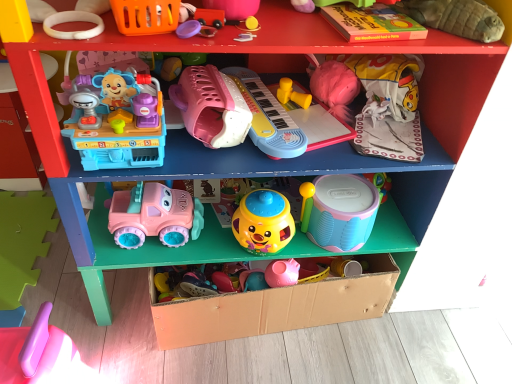
Image resolution: width=512 pixels, height=384 pixels. Find the location of `yellow rubber ball at upper center, which is the 7th toy in right-to-left order`. yellow rubber ball at upper center, which is the 7th toy in right-to-left order is located at coordinates (249, 24).

In order to click on pink plastic keyboard at upper center, which appears as the 3th toy when viewed from the left in this screenshot , I will do `click(211, 107)`.

Measure the distance between pink plastic keyboard at center, which appears as the seventh toy when viewed from the left, and camera.

pink plastic keyboard at center, which appears as the seventh toy when viewed from the left, and camera are 3.53 feet apart.

What is the approximate height of purple plastic lid at upper center, which is the ninth toy in right-to-left order?

It is 0.89 inches.

The height and width of the screenshot is (384, 512). I want to click on yellow plastic toy at upper center, marked as the 4th toy in a right-to-left arrangement, so click(292, 94).

At what (x,y) coordinates should I click in order to perform the action: click on yellow rubber ball at upper center, which is the sixth toy in left-to-right order. Please return your answer as a coordinate pair (x, y). The height and width of the screenshot is (384, 512). Looking at the image, I should click on (249, 24).

Is pink plastic spatula at lower left, marked as the first toy in a left-to-right arrangement, far away from yellow plastic toy at upper center, placed as the ninth toy when sorted from left to right?

That's not correct — pink plastic spatula at lower left, marked as the first toy in a left-to-right arrangement, is a little close to yellow plastic toy at upper center, placed as the ninth toy when sorted from left to right.

There is a pink plastic spatula at lower left, the 12th toy when ordered from right to left. Identify the location of the 5th toy above it (from the image's perspective). The image size is (512, 384). (292, 94).

From the image's perspective, is pink plastic spatula at lower left, marked as the first toy in a left-to-right arrangement, below yellow plastic toy at upper center, placed as the ninth toy when sorted from left to right?

Result: Yes.

Consider the image. From a real-world perspective, does rubber duck at upper center, arranged as the 3th toy when viewed from the right, sit lower than purple plastic lid at upper center, which is the ninth toy in right-to-left order?

Actually, rubber duck at upper center, arranged as the 3th toy when viewed from the right, is physically above purple plastic lid at upper center, which is the ninth toy in right-to-left order, in the real world.

Which is less distant, (383,2) or (183,37)?

Point (383,2) appears to be farther away from the viewer than point (183,37).

Can we say rubber duck at upper center, arranged as the tenth toy when viewed from the left, lies outside purple plastic lid at upper center, which is the fourth toy in left-to-right order?

Yes.

Is rubber duck at upper center, the 8th toy when ordered from right to left, spatially inside yellow matte plastic cup at center, placed as the fifth toy when sorted from right to left, or outside of it?

rubber duck at upper center, the 8th toy when ordered from right to left, is outside yellow matte plastic cup at center, placed as the fifth toy when sorted from right to left.

How many degrees apart are the facing directions of rubber duck at upper center, the 8th toy when ordered from right to left, and yellow matte plastic cup at center, placed as the fifth toy when sorted from right to left?

They differ by 0.00175 degrees in their facing directions.

Is rubber duck at upper center, the 8th toy when ordered from right to left, to the left of yellow matte plastic cup at center, which is the 8th toy in left-to-right order, from the viewer's perspective?

Correct, you'll find rubber duck at upper center, the 8th toy when ordered from right to left, to the left of yellow matte plastic cup at center, which is the 8th toy in left-to-right order.

Is point (254, 6) closer to camera compared to point (250, 214)?

Yes, it is.

Is pastel blue plastic drum at center, the second toy viewed from the right, turned away from pink plastic spatula at lower left, the 12th toy when ordered from right to left?

That's not correct — pastel blue plastic drum at center, the second toy viewed from the right, is not looking away from pink plastic spatula at lower left, the 12th toy when ordered from right to left.

Is pastel blue plastic drum at center, the second toy viewed from the right, surrounding pink plastic spatula at lower left, marked as the first toy in a left-to-right arrangement?

No, pastel blue plastic drum at center, the second toy viewed from the right, does not contain pink plastic spatula at lower left, marked as the first toy in a left-to-right arrangement.

From the image's perspective, which is above, pastel blue plastic drum at center, which is the eleventh toy from left to right, or pink plastic spatula at lower left, the 12th toy when ordered from right to left?

From the image's view, pastel blue plastic drum at center, which is the eleventh toy from left to right, is above.

Is pastel blue plastic drum at center, which is the eleventh toy from left to right, to the left of pink plastic spatula at lower left, the 12th toy when ordered from right to left, from the viewer's perspective?

No.

Are pink plastic keyboard at upper center, which appears as the 3th toy when viewed from the left, and yellow rubber ball at upper center, which is the sixth toy in left-to-right order, beside each other?

No, pink plastic keyboard at upper center, which appears as the 3th toy when viewed from the left, is not beside yellow rubber ball at upper center, which is the sixth toy in left-to-right order.

Considering the positions of objects pink plastic keyboard at upper center, which appears as the 3th toy when viewed from the left, and yellow rubber ball at upper center, which is the sixth toy in left-to-right order, in the image provided, who is more to the right, pink plastic keyboard at upper center, which appears as the 3th toy when viewed from the left, or yellow rubber ball at upper center, which is the sixth toy in left-to-right order,?

yellow rubber ball at upper center, which is the sixth toy in left-to-right order, is more to the right.

Considering the sizes of pink plastic keyboard at upper center, which appears as the 3th toy when viewed from the left, and yellow rubber ball at upper center, which is the 7th toy in right-to-left order, in the image, is pink plastic keyboard at upper center, which appears as the 3th toy when viewed from the left, wider or thinner than yellow rubber ball at upper center, which is the 7th toy in right-to-left order,?

pink plastic keyboard at upper center, which appears as the 3th toy when viewed from the left, is wider than yellow rubber ball at upper center, which is the 7th toy in right-to-left order.

Is pink plastic keyboard at upper center, which appears as the 3th toy when viewed from the left, looking in the opposite direction of yellow rubber ball at upper center, which is the 7th toy in right-to-left order?

No, pink plastic keyboard at upper center, which appears as the 3th toy when viewed from the left, is not facing away from yellow rubber ball at upper center, which is the 7th toy in right-to-left order.

Is yellow rubber ball at upper center, which is the 7th toy in right-to-left order, far from purple plastic lid at upper center, which is the fourth toy in left-to-right order?

No.

From the image's perspective, is yellow rubber ball at upper center, which is the sixth toy in left-to-right order, positioned above or below purple plastic lid at upper center, which is the ninth toy in right-to-left order?

yellow rubber ball at upper center, which is the sixth toy in left-to-right order, is situated higher than purple plastic lid at upper center, which is the ninth toy in right-to-left order, in the image.

Does point (254, 30) lie behind point (183, 23)?

That is True.

Considering the positions of objects yellow rubber ball at upper center, which is the 7th toy in right-to-left order, and purple plastic lid at upper center, which is the fourth toy in left-to-right order, in the image provided, who is behind, yellow rubber ball at upper center, which is the 7th toy in right-to-left order, or purple plastic lid at upper center, which is the fourth toy in left-to-right order,?

yellow rubber ball at upper center, which is the 7th toy in right-to-left order, is behind.

Which of these two, soft plush turtle at upper right, the twelfth toy positioned from the left, or pink plastic keyboard at upper center, the 10th toy positioned from the right, stands taller?

pink plastic keyboard at upper center, the 10th toy positioned from the right, is taller.

Does soft plush turtle at upper right, marked as the 1th toy in a right-to-left arrangement, appear on the right side of pink plastic keyboard at upper center, which appears as the 3th toy when viewed from the left?

Indeed, soft plush turtle at upper right, marked as the 1th toy in a right-to-left arrangement, is positioned on the right side of pink plastic keyboard at upper center, which appears as the 3th toy when viewed from the left.

Can we say soft plush turtle at upper right, the twelfth toy positioned from the left, lies outside pink plastic keyboard at upper center, the 10th toy positioned from the right?

Yes, soft plush turtle at upper right, the twelfth toy positioned from the left, is located beyond the bounds of pink plastic keyboard at upper center, the 10th toy positioned from the right.

How many degrees apart are the facing directions of soft plush turtle at upper right, the twelfth toy positioned from the left, and pink plastic keyboard at upper center, the 10th toy positioned from the right?

The facing directions of soft plush turtle at upper right, the twelfth toy positioned from the left, and pink plastic keyboard at upper center, the 10th toy positioned from the right, are 0.338 degrees apart.

Starting from the yellow plastic toy at upper center, placed as the ninth toy when sorted from left to right, which toy is the 8th one in front? Please provide its 2D coordinates.

[(36, 351)]

There is a rubber duck at upper center, arranged as the tenth toy when viewed from the left. Identify the location of the 4th toy below it (from the image's perspective). The width and height of the screenshot is (512, 384). (188, 29).

Based on their spatial positions, is soft plush turtle at upper right, the twelfth toy positioned from the left, or pink plastic spatula at lower left, the 12th toy when ordered from right to left, further from rubber duck at upper center, the 8th toy when ordered from right to left?

pink plastic spatula at lower left, the 12th toy when ordered from right to left, is positioned further to the anchor rubber duck at upper center, the 8th toy when ordered from right to left.

Looking at the image, which one is located closer to rubber duck at upper center, arranged as the tenth toy when viewed from the left, yellow rubber ball at upper center, which is the 7th toy in right-to-left order, or rubber duck at upper center, which is counted as the 5th toy, starting from the left?

rubber duck at upper center, which is counted as the 5th toy, starting from the left.

Looking at this image, when comparing their distances from rubber duck at upper center, the 8th toy when ordered from right to left, does pink plastic keyboard at center, the 6th toy from the right, or soft plush turtle at upper right, the twelfth toy positioned from the left, seem further?

soft plush turtle at upper right, the twelfth toy positioned from the left, is further to rubber duck at upper center, the 8th toy when ordered from right to left.

When comparing their distances from rubber duck at upper center, which is counted as the 5th toy, starting from the left, does matte pink plastic truck at lower center, the 11th toy in the right-to-left sequence, or soft plush turtle at upper right, marked as the 1th toy in a right-to-left arrangement, seem closer?

Among the two, soft plush turtle at upper right, marked as the 1th toy in a right-to-left arrangement, is located nearer to rubber duck at upper center, which is counted as the 5th toy, starting from the left.

Looking at the image, which one is located closer to pastel blue plastic drum at center, which is the eleventh toy from left to right, purple plastic lid at upper center, which is the fourth toy in left-to-right order, or soft plush turtle at upper right, the twelfth toy positioned from the left?

soft plush turtle at upper right, the twelfth toy positioned from the left, is closer to pastel blue plastic drum at center, which is the eleventh toy from left to right.

Looking at this image, estimate the real-world distances between objects in this image. Which object is further from matte pink plastic truck at lower center, the 11th toy in the right-to-left sequence, yellow rubber ball at upper center, which is the 7th toy in right-to-left order, or pink plastic keyboard at upper center, which appears as the 3th toy when viewed from the left?

yellow rubber ball at upper center, which is the 7th toy in right-to-left order, is further to matte pink plastic truck at lower center, the 11th toy in the right-to-left sequence.

Looking at the image, which one is located closer to pink plastic keyboard at center, which appears as the seventh toy when viewed from the left, yellow rubber ball at upper center, which is the 7th toy in right-to-left order, or rubber duck at upper center, which is counted as the 5th toy, starting from the left?

Among the two, yellow rubber ball at upper center, which is the 7th toy in right-to-left order, is located nearer to pink plastic keyboard at center, which appears as the seventh toy when viewed from the left.

Estimate the real-world distances between objects in this image. Which object is further from rubber duck at upper center, the 8th toy when ordered from right to left, pastel blue plastic drum at center, the second toy viewed from the right, or soft plush turtle at upper right, marked as the 1th toy in a right-to-left arrangement?

pastel blue plastic drum at center, the second toy viewed from the right, lies further to rubber duck at upper center, the 8th toy when ordered from right to left, than the other object.